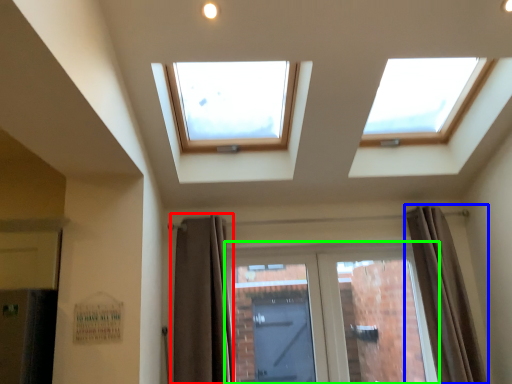
Question: Which is nearer to the curtain (highlighted by a red box)? curtain (highlighted by a blue box) or door (highlighted by a green box).

Choices:
 (A) curtain
 (B) door

Answer: (B)